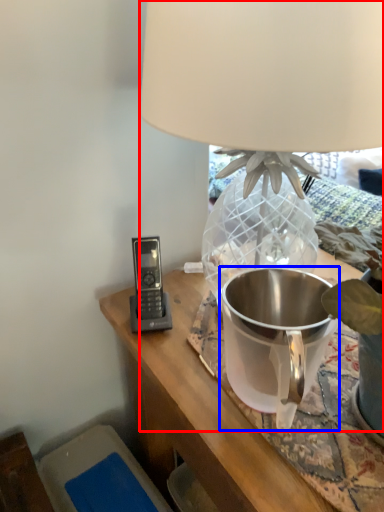
Question: Which of the following is the farthest to the observer, lamp (highlighted by a red box) or appliance (highlighted by a blue box)?

Choices:
 (A) lamp
 (B) appliance

Answer: (B)